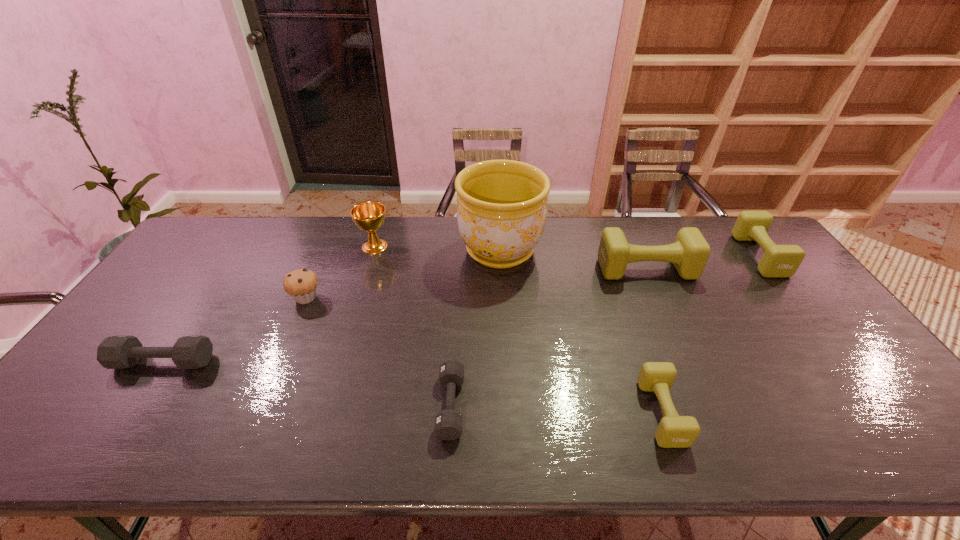
At what (x,y) coordinates should I click in order to perform the action: click on blank space located on the back of the smaller gray dumbbell. Please return your answer as a coordinate pair (x, y). Image resolution: width=960 pixels, height=540 pixels. Looking at the image, I should click on (455, 330).

The image size is (960, 540). Find the location of `flowerpot present at the far edge`. flowerpot present at the far edge is located at coordinates (501, 213).

Find the location of a particular element. This screenshot has width=960, height=540. chalice located at the far edge is located at coordinates (369, 216).

This screenshot has height=540, width=960. I want to click on dumbbell positioned at the far edge, so click(x=778, y=260).

Find the location of `object at the left edge`. object at the left edge is located at coordinates (115, 352).

Locate an element on the screen. The width and height of the screenshot is (960, 540). object present at the right edge is located at coordinates tap(778, 260).

Identify the location of object positioned at the far right corner. This screenshot has width=960, height=540. (778, 260).

The width and height of the screenshot is (960, 540). What are the coordinates of `vacant space at the far edge` in the screenshot? It's located at (431, 229).

The width and height of the screenshot is (960, 540). I want to click on vacant space at the near edge of the desktop, so click(x=408, y=427).

Find the location of a particular element. free space at the right edge is located at coordinates (835, 407).